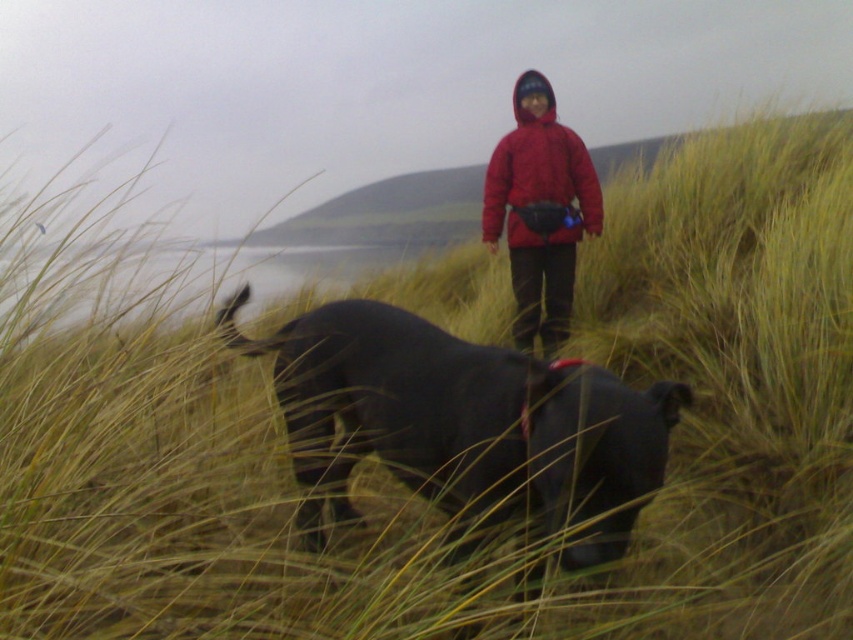
Is black matte dog at center taller than matte red jacket at center?

In fact, black matte dog at center may be shorter than matte red jacket at center.

Which is behind, point (585, 372) or point (584, 193)?

Point (584, 193)

Who is more distant from viewer, (407, 410) or (535, 129)?

Point (535, 129)

Locate an element on the screen. black matte dog at center is located at coordinates (465, 420).